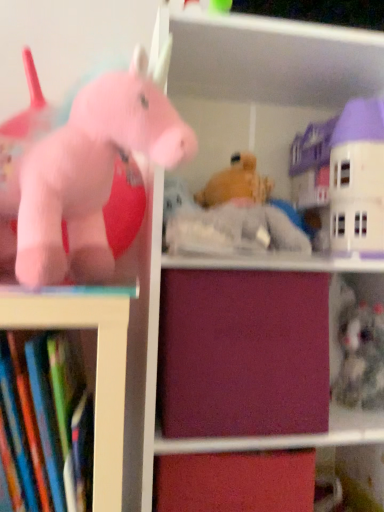
Question: From the image's perspective, is burgundy matte drawer at center above or below hardcover books at left?

Choices:
 (A) below
 (B) above

Answer: (B)

Question: From a real-world perspective, is burgundy matte drawer at center above or below hardcover books at left?

Choices:
 (A) below
 (B) above

Answer: (B)

Question: Considering the real-world distances, which object is farthest from the pastel cream plastic house at upper right, marked as the 2th toy in a front-to-back arrangement?

Choices:
 (A) burgundy matte drawer at center
 (B) fuzzy gray stuffed animal at lower right, which ranks as the 3th toy in front-to-back order
 (C) hardcover books at left
 (D) matte pink plush unicorn at left, which appears as the 3th toy when viewed from the right

Answer: (C)

Question: Which object is the closest to the burgundy matte drawer at center?

Choices:
 (A) fuzzy gray stuffed animal at lower right, acting as the 3th toy starting from the left
 (B) hardcover books at left
 (C) pastel cream plastic house at upper right, the 2th toy in the right-to-left sequence
 (D) matte pink plush unicorn at left, the 3th toy when ordered from back to front

Answer: (B)